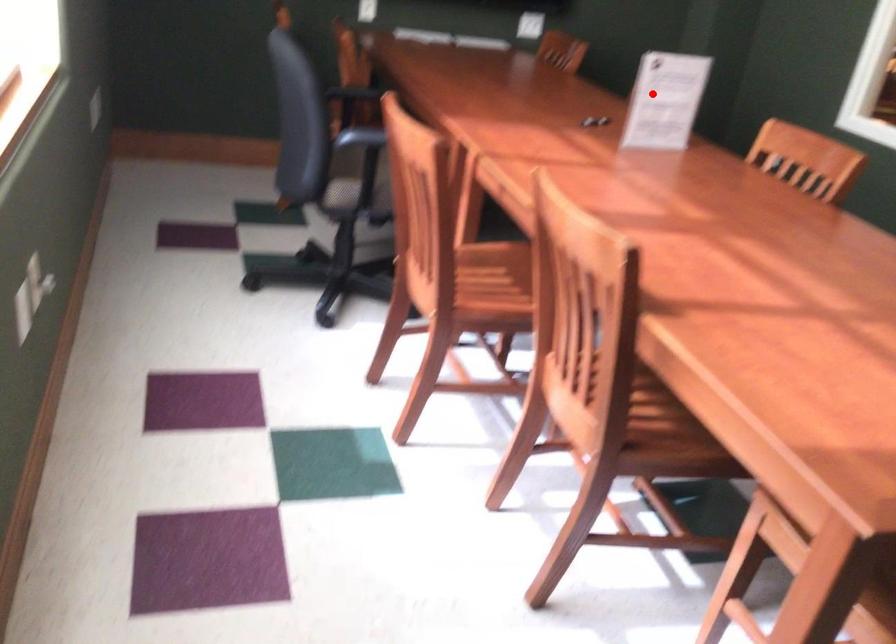
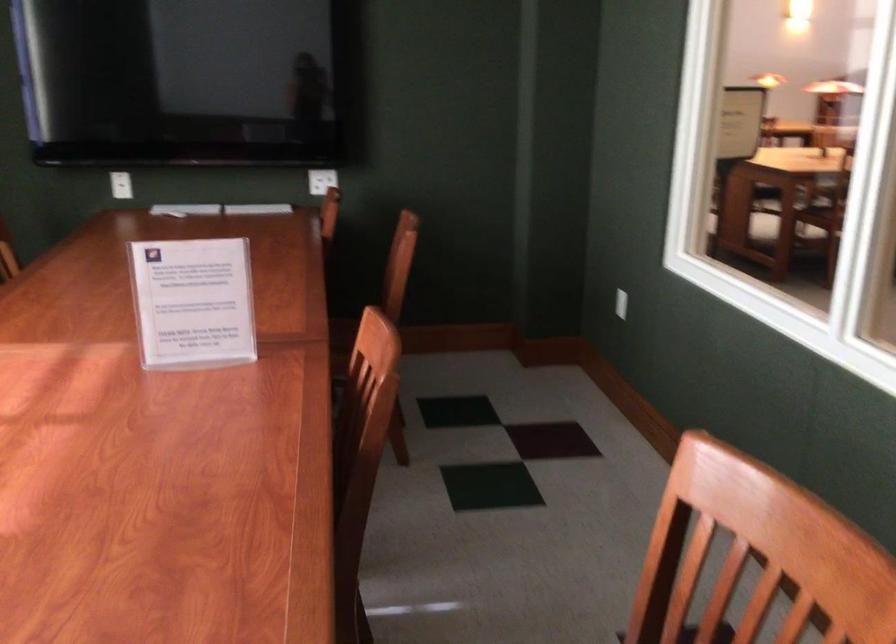
Question: I am providing you with two images of the same scene from different viewpoints. In image1, a red point is highlighted. Considering the same 3D point in image2, which of the following is correct?

Choices:
 (A) It is closer
 (B) It is farther

Answer: (A)